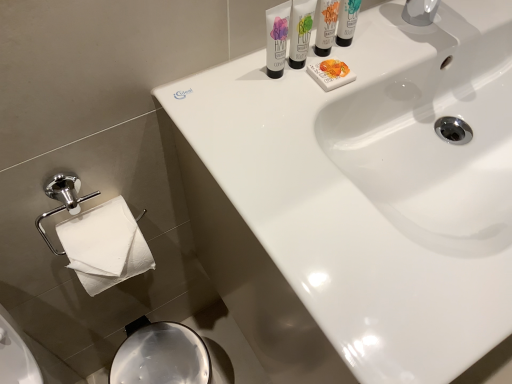
Locate an element on the screen. The image size is (512, 384). vacant space situated on the left part of matte white shaving cream at upper right, the 3th shaving cream from the left is located at coordinates (240, 79).